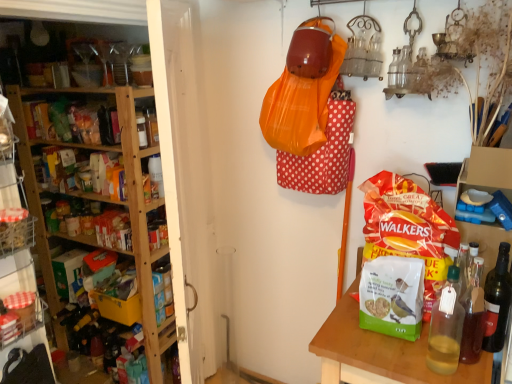
Describe the element at coordinates (380, 352) in the screenshot. I see `wooden table at lower right` at that location.

Locate an element on the screen. matte red bag of chips at right is located at coordinates (408, 229).

Locate an element on the screen. This screenshot has width=512, height=384. wooden shelves at left is located at coordinates (111, 23).

Does wooden shelves at left turn towards translucent glass bottle at right, which is the second bottle in left-to-right order?

Yes, wooden shelves at left faces towards translucent glass bottle at right, which is the second bottle in left-to-right order.

Is wooden shelves at left next to translucent glass bottle at right, which is the second bottle in left-to-right order, and touching it?

wooden shelves at left and translucent glass bottle at right, which is the second bottle in left-to-right order, are clearly separated.

Can you confirm if wooden shelves at left is shorter than translucent glass bottle at right, the first bottle positioned from the right?

In fact, wooden shelves at left may be taller than translucent glass bottle at right, the first bottle positioned from the right.

Is wooden shelves at left smaller than translucent glass bottle at right, which is the second bottle in left-to-right order?

No.

Is translucent glass bottle at right, marked as the 1th bottle in a left-to-right arrangement, oriented towards translucent glass bottle at right, which is the second bottle in left-to-right order?

No, translucent glass bottle at right, marked as the 1th bottle in a left-to-right arrangement, is not facing towards translucent glass bottle at right, which is the second bottle in left-to-right order.

From the image's perspective, is translucent glass bottle at right, marked as the 1th bottle in a left-to-right arrangement, located above translucent glass bottle at right, which is the second bottle in left-to-right order?

Actually, translucent glass bottle at right, marked as the 1th bottle in a left-to-right arrangement, appears below translucent glass bottle at right, which is the second bottle in left-to-right order, in the image.

From a real-world perspective, does translucent glass bottle at right, marked as the 1th bottle in a left-to-right arrangement, stand above translucent glass bottle at right, which is the second bottle in left-to-right order?

Yes.

From the image's perspective, is translucent glass bottle at right, which is the second bottle in left-to-right order, located above matte red bag of chips at right?

No, from the image's perspective, translucent glass bottle at right, which is the second bottle in left-to-right order, is not on top of matte red bag of chips at right.

Is translucent glass bottle at right, which is the second bottle in left-to-right order, completely or partially outside of matte red bag of chips at right?

Absolutely, translucent glass bottle at right, which is the second bottle in left-to-right order, is external to matte red bag of chips at right.

What are the coordinates of `snack to the left of translucent glass bottle at right, which is the second bottle in left-to-right order` in the screenshot? It's located at (408, 229).

From the picture: Is matte red bag of chips at right at the back of translucent glass bottle at right, which is the second bottle in left-to-right order?

No.

Is point (461, 315) farther from camera compared to point (400, 255)?

That is False.

Is translucent glass bottle at right, marked as the 1th bottle in a left-to-right arrangement, oriented towards matte red bag of chips at right?

No, translucent glass bottle at right, marked as the 1th bottle in a left-to-right arrangement, is not oriented towards matte red bag of chips at right.

Which object is positioned more to the right, translucent glass bottle at right, marked as the 1th bottle in a left-to-right arrangement, or matte red bag of chips at right?

translucent glass bottle at right, marked as the 1th bottle in a left-to-right arrangement, is more to the right.

Between translucent glass bottle at right, marked as the 1th bottle in a left-to-right arrangement, and matte red bag of chips at right, which one has larger size?

Bigger between the two is matte red bag of chips at right.

Consider the image. Which object is more forward, wooden table at lower right or translucent glass bottle at right, which is the second bottle in left-to-right order?

wooden table at lower right is closer to the camera.

Is point (349, 293) closer to viewer compared to point (492, 315)?

No, (349, 293) is behind (492, 315).

Is wooden table at lower right thinner than translucent glass bottle at right, the first bottle positioned from the right?

In fact, wooden table at lower right might be wider than translucent glass bottle at right, the first bottle positioned from the right.

Between translucent glass bottle at right, which is the second bottle in left-to-right order, and wooden table at lower right, which one appears on the left side from the viewer's perspective?

wooden table at lower right.

Would you say translucent glass bottle at right, which is the second bottle in left-to-right order, is outside wooden table at lower right?

Yes, translucent glass bottle at right, which is the second bottle in left-to-right order, is located beyond the bounds of wooden table at lower right.

From the image's perspective, relative to wooden table at lower right, is translucent glass bottle at right, the first bottle positioned from the right, above or below?

Based on their image positions, translucent glass bottle at right, the first bottle positioned from the right, is located above wooden table at lower right.

Relative to translucent glass bottle at right, marked as the 1th bottle in a left-to-right arrangement, is wooden shelves at left in front or behind?

wooden shelves at left is positioned closer to the viewer than translucent glass bottle at right, marked as the 1th bottle in a left-to-right arrangement.

From the image's perspective, is wooden shelves at left beneath translucent glass bottle at right, marked as the 1th bottle in a left-to-right arrangement?

Incorrect, from the image's perspective, wooden shelves at left is higher than translucent glass bottle at right, marked as the 1th bottle in a left-to-right arrangement.

Is translucent glass bottle at right, marked as the 1th bottle in a left-to-right arrangement, a part of wooden shelves at left?

No, translucent glass bottle at right, marked as the 1th bottle in a left-to-right arrangement, is located outside of wooden shelves at left.

Which point is more forward, (161, 40) or (433, 311)?

Positioned in front is point (161, 40).

This screenshot has width=512, height=384. I want to click on the 1st bottle directly above the wooden shelves at left (from a real-world perspective), so click(x=497, y=302).

Identify the location of bottle below the translucent glass bottle at right, which is the second bottle in left-to-right order (from the image's perspective). coord(446,327).

Which object lies further to the anchor point translucent glass bottle at right, the first bottle positioned from the right, translucent glass bottle at right, marked as the 1th bottle in a left-to-right arrangement, or wooden shelves at left?

wooden shelves at left.

Based on their spatial positions, is translucent glass bottle at right, which is the second bottle in left-to-right order, or translucent glass bottle at right, which is the second bottle in right-to-left order, closer to matte red bag of chips at right?

translucent glass bottle at right, which is the second bottle in right-to-left order.

Looking at the image, which one is located closer to wooden shelves at left, translucent glass bottle at right, the first bottle positioned from the right, or matte red bag of chips at right?

The object closer to wooden shelves at left is matte red bag of chips at right.

Considering their positions, is matte red bag of chips at right positioned further to wooden shelves at left than wooden table at lower right?

matte red bag of chips at right lies further to wooden shelves at left than the other object.

Based on their spatial positions, is translucent glass bottle at right, which is the second bottle in left-to-right order, or wooden table at lower right closer to matte red bag of chips at right?

The object closer to matte red bag of chips at right is translucent glass bottle at right, which is the second bottle in left-to-right order.

When comparing their distances from matte red bag of chips at right, does wooden shelves at left or wooden table at lower right seem further?

Based on the image, wooden shelves at left appears to be further to matte red bag of chips at right.

Which object lies further to the anchor point translucent glass bottle at right, which is the second bottle in left-to-right order, matte red bag of chips at right or wooden table at lower right?

The object further to translucent glass bottle at right, which is the second bottle in left-to-right order, is wooden table at lower right.

Looking at the image, which one is located further to wooden table at lower right, matte red bag of chips at right or translucent glass bottle at right, the first bottle positioned from the right?

Among the two, translucent glass bottle at right, the first bottle positioned from the right, is located further to wooden table at lower right.

You are a GUI agent. You are given a task and a screenshot of the screen. Output one action in this format:
    pyautogui.click(x=<x>, y=<y>)
    Task: Click on the snack between wooden shelves at left and translucent glass bottle at right, which is the second bottle in right-to-left order, in the horizontal direction
    This screenshot has width=512, height=384.
    Given the screenshot: What is the action you would take?
    pyautogui.click(x=408, y=229)

In order to click on bottle between translucent glass bottle at right, which is the second bottle in left-to-right order, and wooden table at lower right from top to bottom in this screenshot , I will do `click(446, 327)`.

Identify the location of snack between wooden shelves at left and translucent glass bottle at right, which is the second bottle in left-to-right order. The height and width of the screenshot is (384, 512). (408, 229).

The image size is (512, 384). I want to click on table located between wooden shelves at left and translucent glass bottle at right, the first bottle positioned from the right, in the left-right direction, so click(380, 352).